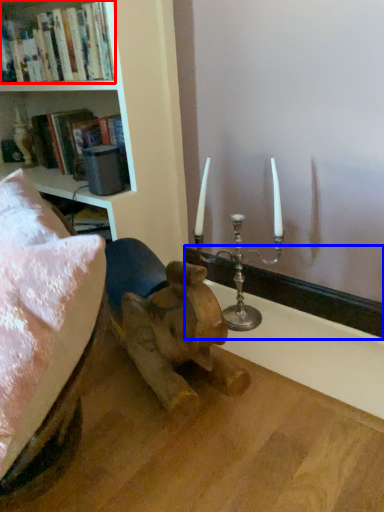
Question: Among these objects, which one is nearest to the camera, book (highlighted by a red box) or window sill (highlighted by a blue box)?

Choices:
 (A) book
 (B) window sill

Answer: (A)